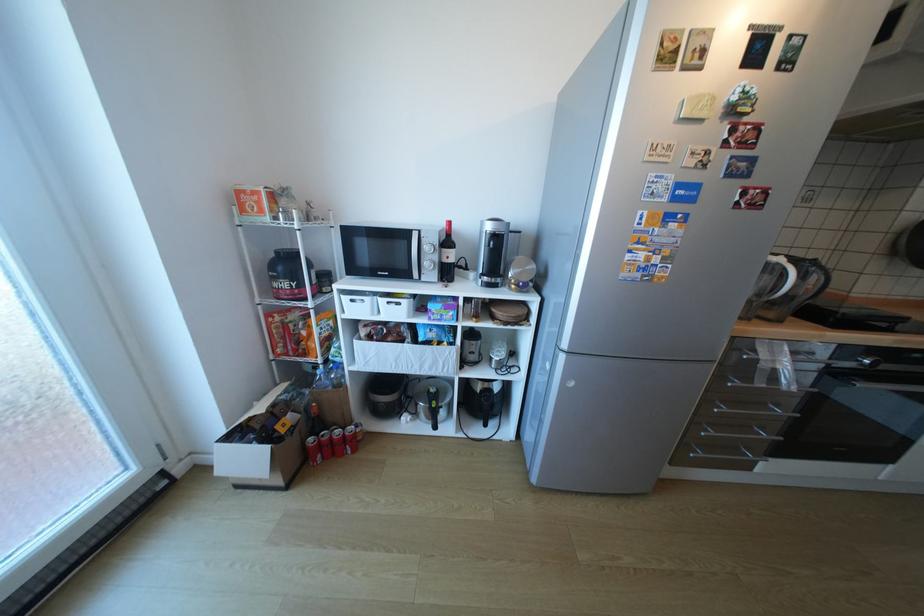
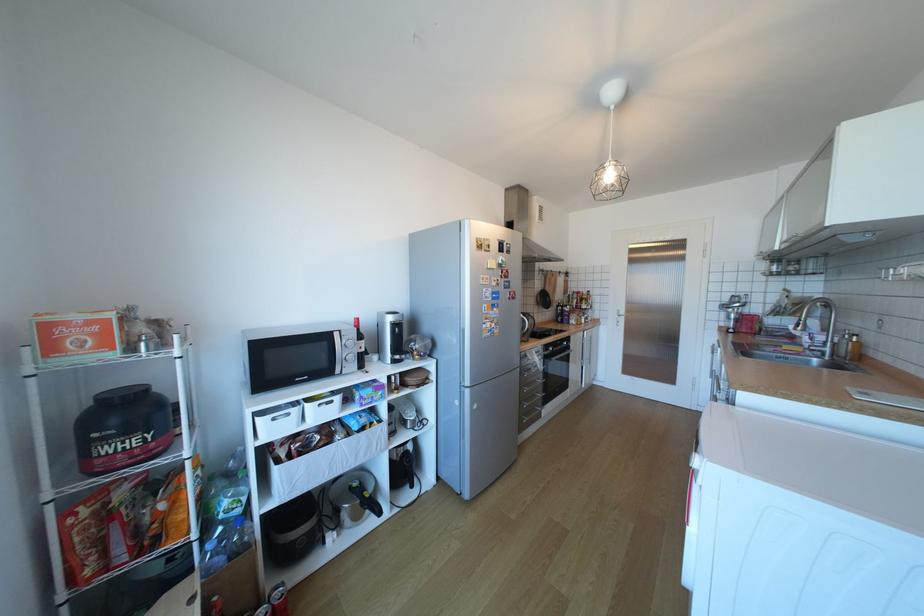
The point at (772, 386) is marked in the first image. Where is the corresponding point in the second image?

(543, 371)